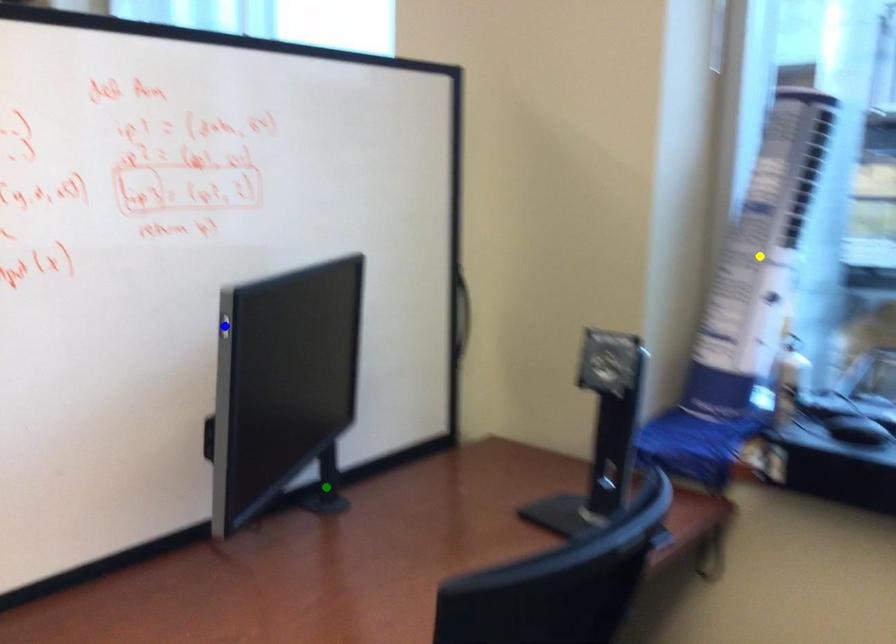
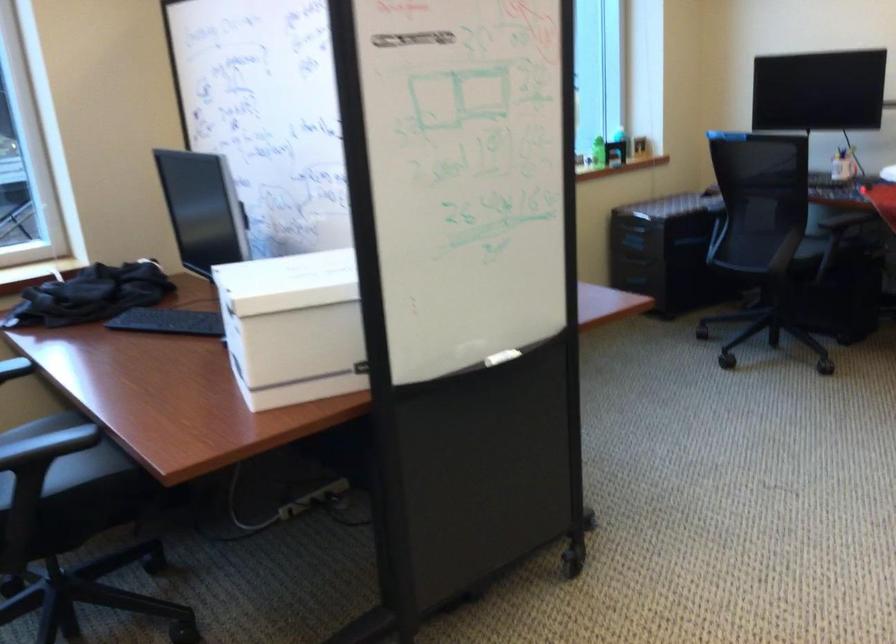
I am providing you with two images of the same scene from different viewpoints. Three points are marked in image1. Which point corresponds to a part or object that is occluded in image2?In image1, three points are marked. Which of them correspond to a part or object that is occluded in image2?Among the three points shown in image1, which one corresponds to a part or object that is no longer visible due to occlusion in image2?

Invisible in image2: green point, blue point, yellow point.